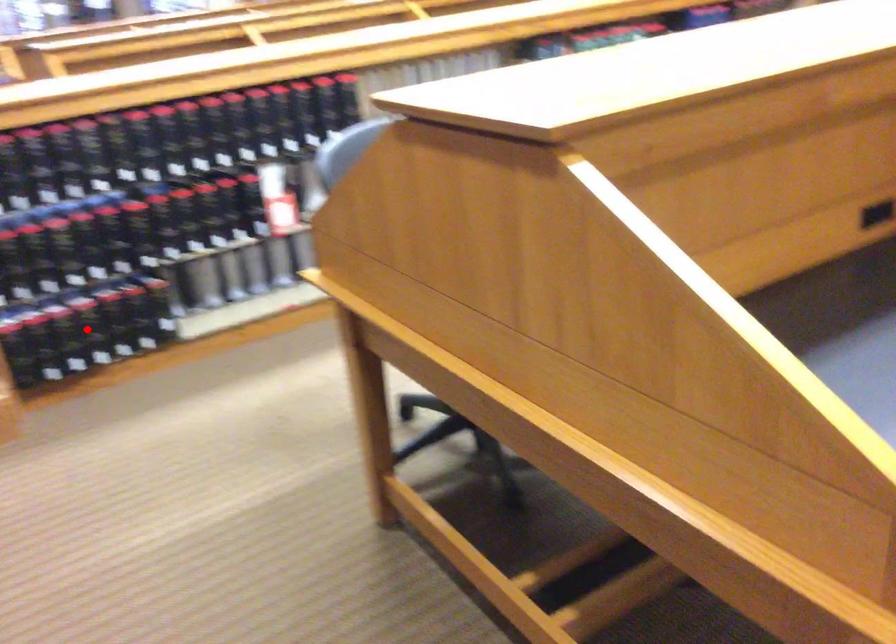
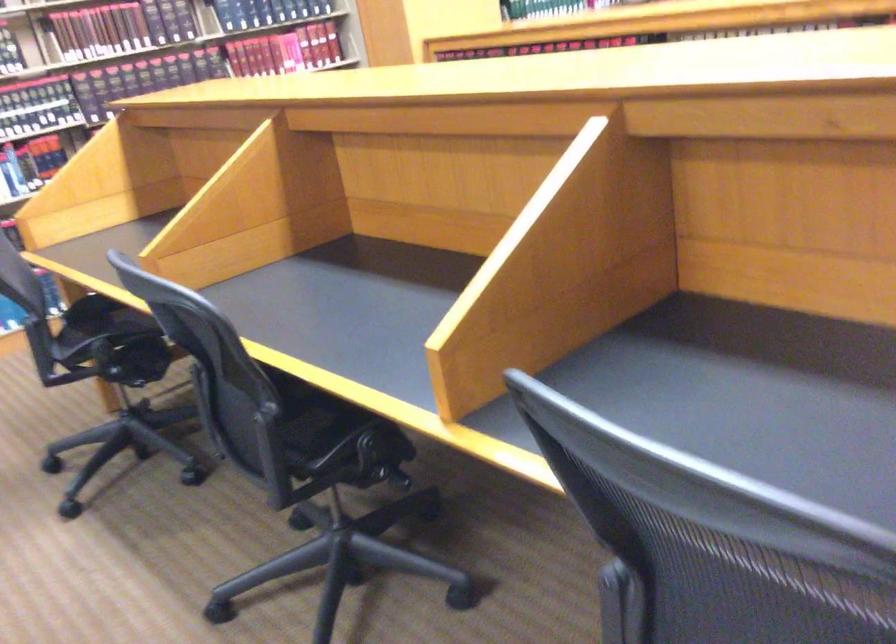
Question: I am providing you with two images of the same scene from different viewpoints. A red point is marked on the first image. At the location where the point appears in image 1, is it still visible in image 2?

Choices:
 (A) Yes
 (B) No

Answer: (B)